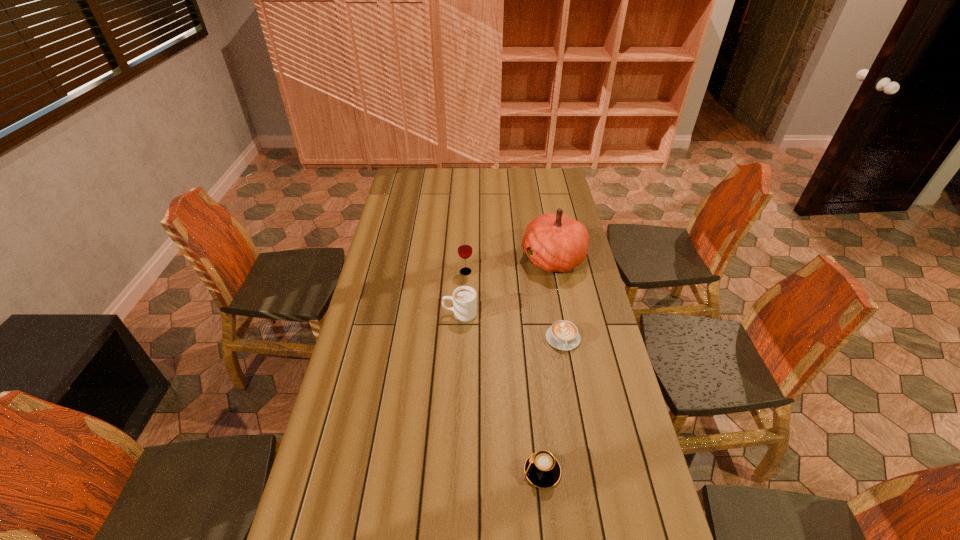
The image size is (960, 540). In the image, there is a desktop. In order to click on vacant space at the left edge in this screenshot , I will do `click(323, 513)`.

In the image, there is a desktop. Identify the location of vacant area at the right edge. The width and height of the screenshot is (960, 540). (582, 397).

You are a GUI agent. You are given a task and a screenshot of the screen. Output one action in this format:
    pyautogui.click(x=<x>, y=<y>)
    Task: Click on the free spot between the second cappuccino from right to left and the leftmost cappuccino
    This screenshot has height=540, width=960.
    Given the screenshot: What is the action you would take?
    pyautogui.click(x=501, y=392)

The height and width of the screenshot is (540, 960). Identify the location of vacant area between the shortest cappuccino and the nearest object. (553, 405).

What are the coordinates of `vacant area between the second cappuccino from left to right and the pumpkin` in the screenshot? It's located at (547, 364).

You are a GUI agent. You are given a task and a screenshot of the screen. Output one action in this format:
    pyautogui.click(x=<x>, y=<y>)
    Task: Click on the object identified as the third closest to the second tallest object
    The height and width of the screenshot is (540, 960).
    Given the screenshot: What is the action you would take?
    pyautogui.click(x=563, y=335)

Where is `the fourth closest object relative to the third farthest object`? the fourth closest object relative to the third farthest object is located at coordinates (542, 469).

Where is `cappuccino that is the closest one to the second tallest cappuccino`? cappuccino that is the closest one to the second tallest cappuccino is located at coordinates (563, 335).

Where is `cappuccino identified as the closest to the shortest object`? This screenshot has width=960, height=540. cappuccino identified as the closest to the shortest object is located at coordinates (464, 298).

I want to click on blank space that satisfies the following two spatial constraints: 1. on the front side of the fourth shortest object; 2. on the side with the handle of the leftmost cappuccino, so click(465, 314).